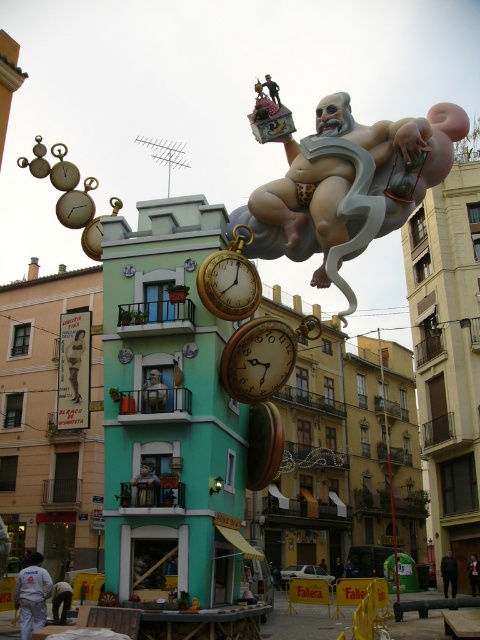
You are an artist planning to place a new sculpture in this festive scene. The sculpture must be positioned so that it doesn not block the view of the existing central objects. Given that the matte gold statue at center is much taller than the gold metallic pocket watch at center, which object should you avoid placing your sculpture in front of to maintain visibility?

You should avoid placing your sculpture in front of the matte gold statue at center because it is taller than the gold metallic pocket watch at center, so blocking it would obstruct the view of both central objects.

You are an event planner arranging decorations for the festival. You have two items to place on the main stage. The gold metallic clock at center and the gold metallic pocket watch at center. If you want to place them side by side, which one should you choose if you need the larger one to be more visible from a distance?

The gold metallic clock at center is larger than the gold metallic pocket watch at center, so you should choose the gold metallic clock at center to be placed where it needs to be more visible from a distance.

You are an event planner setting up for a time theme party. You notice the matte gold statue at center and the gold metallic pocket watch at center. Which object is positioned higher in the scene?

The matte gold statue at center is above the gold metallic pocket watch at center, so it is positioned higher in the scene.